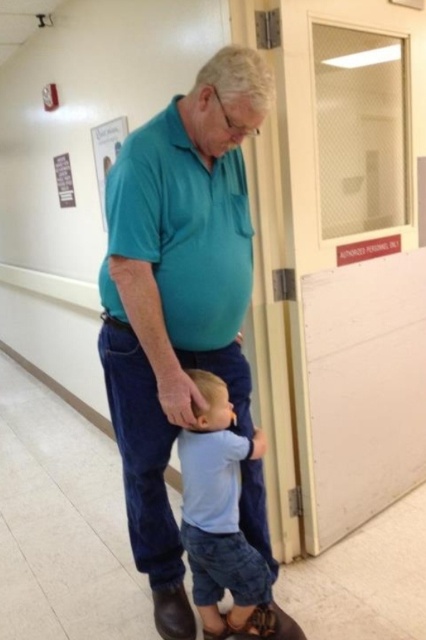
Question: Does teal smooth shirt at center appear over light blue denim shorts at lower center?

Choices:
 (A) no
 (B) yes

Answer: (B)

Question: Can you confirm if teal smooth shirt at center is thinner than light blue denim shorts at lower center?

Choices:
 (A) no
 (B) yes

Answer: (A)

Question: Which point is closer to the camera taking this photo?

Choices:
 (A) (212, 582)
 (B) (137, 150)

Answer: (B)

Question: Can you confirm if teal smooth shirt at center is wider than light blue denim shorts at lower center?

Choices:
 (A) yes
 (B) no

Answer: (A)

Question: Which point appears farthest from the camera in this image?

Choices:
 (A) (242, 476)
 (B) (247, 618)

Answer: (A)

Question: Among these objects, which one is nearest to the camera?

Choices:
 (A) teal smooth shirt at center
 (B) light blue denim shorts at lower center

Answer: (A)